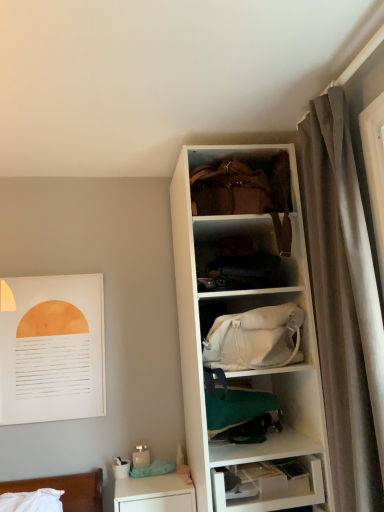
Question: Considering the relative positions of velvet gray curtain at right and white matte cabinet at center in the image provided, is velvet gray curtain at right to the left or to the right of white matte cabinet at center?

Choices:
 (A) left
 (B) right

Answer: (B)

Question: In the image, is velvet gray curtain at right positioned in front of or behind white matte cabinet at center?

Choices:
 (A) front
 (B) behind

Answer: (A)

Question: Based on their relative distances, which object is farther from the matte black clothing at center, acting as the first shelf starting from the top?

Choices:
 (A) white plastic shelf at lower center, the fourth shelf when ordered from top to bottom
 (B) white glossy table at lower left
 (C) green fabric bag at center, the second shelf in the bottom-to-top sequence
 (D) white fabric bag at center, acting as the second shelf starting from the top
 (E) white paper at upper left

Answer: (B)

Question: Estimate the real-world distances between objects in this image. Which object is farther from the white matte cabinet at center?

Choices:
 (A) green fabric bag at center, the second shelf in the bottom-to-top sequence
 (B) velvet gray curtain at right
 (C) white paper at upper left
 (D) white plastic shelf at lower center, the fourth shelf when ordered from top to bottom
 (E) white fabric bag at center, which is counted as the third shelf, starting from the bottom

Answer: (D)